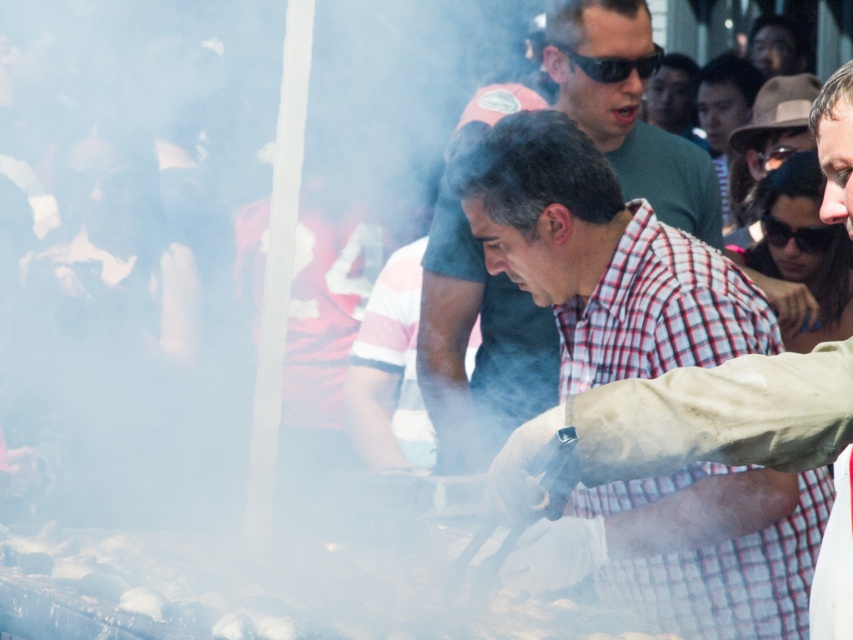
Can you confirm if checkered fabric shirt at center is thinner than black plastic sunglasses at upper right?

In fact, checkered fabric shirt at center might be wider than black plastic sunglasses at upper right.

Consider the image. Is the position of checkered fabric shirt at center less distant than that of black plastic sunglasses at upper right?

Yes.

Find the location of a particular element. This screenshot has width=853, height=640. checkered fabric shirt at center is located at coordinates (602, 259).

At what (x,y) coordinates should I click in order to perform the action: click on checkered fabric shirt at center. Please return your answer as a coordinate pair (x, y). This screenshot has height=640, width=853. Looking at the image, I should click on (602, 259).

Between black plastic sunglasses at upper center and black plastic sunglasses at upper right, which one is positioned higher?

black plastic sunglasses at upper center is higher up.

Does black plastic sunglasses at upper center have a larger size compared to black plastic sunglasses at upper right?

Indeed, black plastic sunglasses at upper center has a larger size compared to black plastic sunglasses at upper right.

This screenshot has width=853, height=640. I want to click on black plastic sunglasses at upper center, so click(614, 65).

The width and height of the screenshot is (853, 640). Find the location of `black plastic sunglasses at upper center`. black plastic sunglasses at upper center is located at coordinates (614, 65).

Who is positioned more to the right, plaid cotton shirt at center or black plastic sunglasses at upper right?

From the viewer's perspective, black plastic sunglasses at upper right appears more on the right side.

Does point (651, 144) come in front of point (780, 240)?

Yes, it is.

You are a GUI agent. You are given a task and a screenshot of the screen. Output one action in this format:
    pyautogui.click(x=<x>, y=<y>)
    Task: Click on the plaid cotton shirt at center
    Image resolution: width=853 pixels, height=640 pixels.
    Given the screenshot: What is the action you would take?
    pyautogui.click(x=479, y=346)